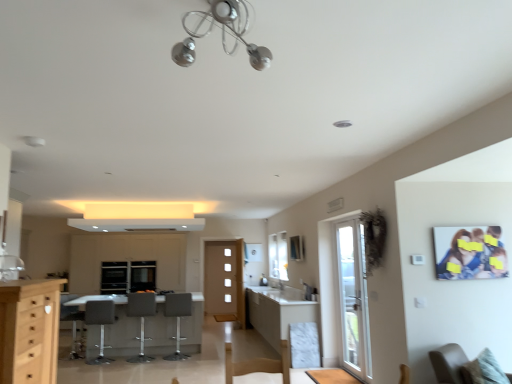
Question: From a real-world perspective, is beige fabric chair at lower right positioned above or below black glass window screen at center?

Choices:
 (A) above
 (B) below

Answer: (B)

Question: Do you think beige fabric chair at lower right is within black glass window screen at center, or outside of it?

Choices:
 (A) outside
 (B) inside

Answer: (A)

Question: Which object is the farthest from the matte photo frame at upper right?

Choices:
 (A) white glass door at right
 (B) beige fabric chair at lower right
 (C) white glossy exhaust hood at upper center
 (D) matte gray bar stool at center, which is the first armchair in right-to-left order
 (E) grey fabric bar stool at center, positioned as the 3th armchair in left-to-right order

Answer: (C)

Question: Which object is positioned farthest from the black glass window screen at center?

Choices:
 (A) light wood cabinet at left, the second cabinetry from the left
 (B) gray fabric armchair at lower left, arranged as the 1th armchair when viewed from the left
 (C) white glossy exhaust hood at upper center
 (D) gray fabric bar stool at lower left, marked as the third armchair in a right-to-left arrangement
 (E) matte photo frame at upper right

Answer: (E)